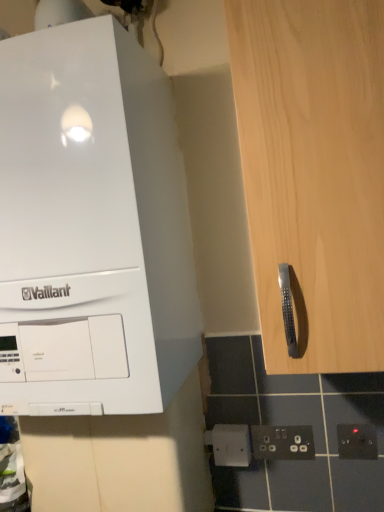
In order to face black plastic electric outlet at lower right, which ranks as the third electric outlet in left-to-right order, should I rotate leftwards or rightwards?

Turn right by 21.206 degrees to look at black plastic electric outlet at lower right, which ranks as the third electric outlet in left-to-right order.

What is the approximate height of light wood cabinet handle at right?

light wood cabinet handle at right is 78.42 centimeters tall.

Locate an element on the screen. black plastic electric outlet at lower right, which is the first electric outlet from right to left is located at coordinates (357, 441).

Are white glossy vaillant boiler at upper left and black plastic electric outlet at lower right, which is the first electric outlet from right to left, making contact?

No, white glossy vaillant boiler at upper left is not making contact with black plastic electric outlet at lower right, which is the first electric outlet from right to left.

Considering the positions of objects white glossy vaillant boiler at upper left and black plastic electric outlet at lower right, which ranks as the third electric outlet in left-to-right order, in the image provided, who is more to the right, white glossy vaillant boiler at upper left or black plastic electric outlet at lower right, which ranks as the third electric outlet in left-to-right order,?

From the viewer's perspective, black plastic electric outlet at lower right, which ranks as the third electric outlet in left-to-right order, appears more on the right side.

Is white glossy vaillant boiler at upper left oriented towards black plastic electric outlet at lower right, which is the first electric outlet from right to left?

No, white glossy vaillant boiler at upper left is not aimed at black plastic electric outlet at lower right, which is the first electric outlet from right to left.

From the image's perspective, which is below, white glossy vaillant boiler at upper left or black plastic electric outlet at lower right, which ranks as the third electric outlet in left-to-right order?

black plastic electric outlet at lower right, which ranks as the third electric outlet in left-to-right order, from the image's perspective.

Is white plastic electric outlet at lower center, positioned as the third electric outlet in right-to-left order, at the back of white glossy vaillant boiler at upper left?

No, white glossy vaillant boiler at upper left is not facing away from white plastic electric outlet at lower center, positioned as the third electric outlet in right-to-left order.

Consider the image. From the image's perspective, who appears lower, white glossy vaillant boiler at upper left or white plastic electric outlet at lower center, positioned as the third electric outlet in right-to-left order?

white plastic electric outlet at lower center, positioned as the third electric outlet in right-to-left order.

Can you tell me how much white glossy vaillant boiler at upper left and white plastic electric outlet at lower center, which ranks as the 1th electric outlet in left-to-right order, differ in facing direction?

The facing directions of white glossy vaillant boiler at upper left and white plastic electric outlet at lower center, which ranks as the 1th electric outlet in left-to-right order, are 0.000809 degrees apart.

Is white glossy vaillant boiler at upper left positioned beyond the bounds of white plastic electric outlet at lower center, positioned as the third electric outlet in right-to-left order?

Absolutely, white glossy vaillant boiler at upper left is external to white plastic electric outlet at lower center, positioned as the third electric outlet in right-to-left order.

In the scene shown: Would you say white plastic electric outlet at lower center, positioned as the third electric outlet in right-to-left order, is part of black plastic electric outlet at lower right, which ranks as the third electric outlet in left-to-right order,'s contents?

Definitely not — white plastic electric outlet at lower center, positioned as the third electric outlet in right-to-left order, is not inside black plastic electric outlet at lower right, which ranks as the third electric outlet in left-to-right order.

Is black plastic electric outlet at lower right, which ranks as the third electric outlet in left-to-right order, oriented towards white plastic electric outlet at lower center, which ranks as the 1th electric outlet in left-to-right order?

No, black plastic electric outlet at lower right, which ranks as the third electric outlet in left-to-right order, is not facing towards white plastic electric outlet at lower center, which ranks as the 1th electric outlet in left-to-right order.

Which object is closer to the camera, black plastic electric outlet at lower right, which is the first electric outlet from right to left, or white plastic electric outlet at lower center, which ranks as the 1th electric outlet in left-to-right order?

black plastic electric outlet at lower right, which is the first electric outlet from right to left, is more forward.

Is point (369, 444) less distant than point (220, 424)?

Yes, point (369, 444) is closer to viewer.

Could you tell me if light wood cabinet handle at right is facing black plastic electric outlet at lower right, which is the first electric outlet from right to left?

No, light wood cabinet handle at right is not facing towards black plastic electric outlet at lower right, which is the first electric outlet from right to left.

From the image's perspective, is light wood cabinet handle at right on top of black plastic electric outlet at lower right, which ranks as the third electric outlet in left-to-right order?

Yes, from the image's perspective, light wood cabinet handle at right is on top of black plastic electric outlet at lower right, which ranks as the third electric outlet in left-to-right order.

Can you confirm if light wood cabinet handle at right is thinner than black plastic electric outlet at lower right, which is the first electric outlet from right to left?

Incorrect, the width of light wood cabinet handle at right is not less than that of black plastic electric outlet at lower right, which is the first electric outlet from right to left.

In the scene shown: From a real-world perspective, is light wood cabinet handle at right positioned under black plastic electric outlet at lower right, which ranks as the third electric outlet in left-to-right order, based on gravity?

Incorrect, from a real-world perspective, light wood cabinet handle at right is higher than black plastic electric outlet at lower right, which ranks as the third electric outlet in left-to-right order.

Is black plastic electric outlet at lower right, which is the first electric outlet from right to left, located within white plastic electric outlet at lower center, which ranks as the 1th electric outlet in left-to-right order?

No, black plastic electric outlet at lower right, which is the first electric outlet from right to left, is not inside white plastic electric outlet at lower center, which ranks as the 1th electric outlet in left-to-right order.

Between white plastic electric outlet at lower center, which ranks as the 1th electric outlet in left-to-right order, and black plastic electric outlet at lower right, which is the first electric outlet from right to left, which one has larger width?

With larger width is white plastic electric outlet at lower center, which ranks as the 1th electric outlet in left-to-right order.

Which is in front, white plastic electric outlet at lower center, which ranks as the 1th electric outlet in left-to-right order, or black plastic electric outlet at lower right, which is the first electric outlet from right to left?

black plastic electric outlet at lower right, which is the first electric outlet from right to left, is in front.

From a real-world perspective, is white plastic electric outlet at lower center, positioned as the third electric outlet in right-to-left order, positioned above or below black plastic electric outlet at lower right, which ranks as the third electric outlet in left-to-right order?

white plastic electric outlet at lower center, positioned as the third electric outlet in right-to-left order, is situated lower than black plastic electric outlet at lower right, which ranks as the third electric outlet in left-to-right order, in the real world.

Looking at this image, which object is wider, white plastic socket at lower center, which is the second electric outlet in left-to-right order, or light wood cabinet handle at right?

light wood cabinet handle at right is wider.

From a real-world perspective, is white plastic socket at lower center, which is the second electric outlet in left-to-right order, under light wood cabinet handle at right?

Indeed, from a real-world perspective, white plastic socket at lower center, which is the second electric outlet in left-to-right order, is positioned beneath light wood cabinet handle at right.

Can you tell me how much white plastic socket at lower center, which is the second electric outlet in left-to-right order, and light wood cabinet handle at right differ in facing direction?

There is a 0.00628-degree angle between the facing directions of white plastic socket at lower center, which is the second electric outlet in left-to-right order, and light wood cabinet handle at right.

Is white plastic socket at lower center, which is the second electric outlet in left-to-right order, not near light wood cabinet handle at right?

No, white plastic socket at lower center, which is the second electric outlet in left-to-right order, is not far away from light wood cabinet handle at right.

Find the location of a particular element. The image size is (384, 512). cabinetry on the left of black plastic electric outlet at lower right, which is the first electric outlet from right to left is located at coordinates (314, 173).

Would you say light wood cabinet handle at right is part of black plastic electric outlet at lower right, which ranks as the third electric outlet in left-to-right order,'s contents?

No, black plastic electric outlet at lower right, which ranks as the third electric outlet in left-to-right order, does not contain light wood cabinet handle at right.

Is black plastic electric outlet at lower right, which ranks as the third electric outlet in left-to-right order, in front of or behind light wood cabinet handle at right in the image?

black plastic electric outlet at lower right, which ranks as the third electric outlet in left-to-right order, is behind light wood cabinet handle at right.

From a real-world perspective, which is physically below, black plastic electric outlet at lower right, which is the first electric outlet from right to left, or light wood cabinet handle at right?

black plastic electric outlet at lower right, which is the first electric outlet from right to left.

The width and height of the screenshot is (384, 512). In order to click on home appliance that is above the black plastic electric outlet at lower right, which is the first electric outlet from right to left (from the image's perspective) in this screenshot , I will do `click(92, 229)`.

Where is `the 3rd electric outlet below when counting from the white glossy vaillant boiler at upper left (from the image's perspective)`? The image size is (384, 512). the 3rd electric outlet below when counting from the white glossy vaillant boiler at upper left (from the image's perspective) is located at coordinates (230, 444).

When comparing their distances from white plastic socket at lower center, which is the second electric outlet in left-to-right order, does black plastic electric outlet at lower right, which ranks as the third electric outlet in left-to-right order, or white plastic electric outlet at lower center, which ranks as the 1th electric outlet in left-to-right order, seem further?

black plastic electric outlet at lower right, which ranks as the third electric outlet in left-to-right order, is further to white plastic socket at lower center, which is the second electric outlet in left-to-right order.

Consider the image. Estimate the real-world distances between objects in this image. Which object is closer to white glossy vaillant boiler at upper left, white plastic electric outlet at lower center, which ranks as the 1th electric outlet in left-to-right order, or black plastic electric outlet at lower right, which ranks as the third electric outlet in left-to-right order?

white plastic electric outlet at lower center, which ranks as the 1th electric outlet in left-to-right order, lies closer to white glossy vaillant boiler at upper left than the other object.

Considering their positions, is white plastic socket at lower center, which is the second electric outlet in left-to-right order, positioned further to white glossy vaillant boiler at upper left than light wood cabinet handle at right?

Result: white plastic socket at lower center, which is the second electric outlet in left-to-right order, lies further to white glossy vaillant boiler at upper left than the other object.

Looking at the image, which one is located further to white glossy vaillant boiler at upper left, black plastic electric outlet at lower right, which ranks as the third electric outlet in left-to-right order, or white plastic socket at lower center, marked as the second electric outlet in a right-to-left arrangement?

black plastic electric outlet at lower right, which ranks as the third electric outlet in left-to-right order, is further to white glossy vaillant boiler at upper left.

Considering their positions, is white plastic socket at lower center, marked as the second electric outlet in a right-to-left arrangement, positioned closer to white plastic electric outlet at lower center, which ranks as the 1th electric outlet in left-to-right order, than black plastic electric outlet at lower right, which ranks as the third electric outlet in left-to-right order?

The object closer to white plastic electric outlet at lower center, which ranks as the 1th electric outlet in left-to-right order, is white plastic socket at lower center, marked as the second electric outlet in a right-to-left arrangement.

Estimate the real-world distances between objects in this image. Which object is further from light wood cabinet handle at right, white plastic socket at lower center, which is the second electric outlet in left-to-right order, or black plastic electric outlet at lower right, which ranks as the third electric outlet in left-to-right order?

The object further to light wood cabinet handle at right is black plastic electric outlet at lower right, which ranks as the third electric outlet in left-to-right order.

In the scene shown: Considering their positions, is white glossy vaillant boiler at upper left positioned further to light wood cabinet handle at right than black plastic electric outlet at lower right, which ranks as the third electric outlet in left-to-right order?

Based on the image, black plastic electric outlet at lower right, which ranks as the third electric outlet in left-to-right order, appears to be further to light wood cabinet handle at right.

From the image, which object appears to be farther from light wood cabinet handle at right, white plastic electric outlet at lower center, which ranks as the 1th electric outlet in left-to-right order, or black plastic electric outlet at lower right, which is the first electric outlet from right to left?

white plastic electric outlet at lower center, which ranks as the 1th electric outlet in left-to-right order.

Locate an element on the screen. electric outlet between white plastic electric outlet at lower center, which ranks as the 1th electric outlet in left-to-right order, and black plastic electric outlet at lower right, which is the first electric outlet from right to left, in the horizontal direction is located at coordinates (282, 442).

Where is `electric outlet between white glossy vaillant boiler at upper left and white plastic socket at lower center, marked as the second electric outlet in a right-to-left arrangement, in the up-down direction`? The height and width of the screenshot is (512, 384). electric outlet between white glossy vaillant boiler at upper left and white plastic socket at lower center, marked as the second electric outlet in a right-to-left arrangement, in the up-down direction is located at coordinates (357, 441).

Where is `home appliance between light wood cabinet handle at right and white plastic electric outlet at lower center, positioned as the third electric outlet in right-to-left order, in the up-down direction`? The width and height of the screenshot is (384, 512). home appliance between light wood cabinet handle at right and white plastic electric outlet at lower center, positioned as the third electric outlet in right-to-left order, in the up-down direction is located at coordinates (92, 229).

Locate an element on the screen. The height and width of the screenshot is (512, 384). home appliance between light wood cabinet handle at right and white plastic socket at lower center, marked as the second electric outlet in a right-to-left arrangement, from top to bottom is located at coordinates (92, 229).